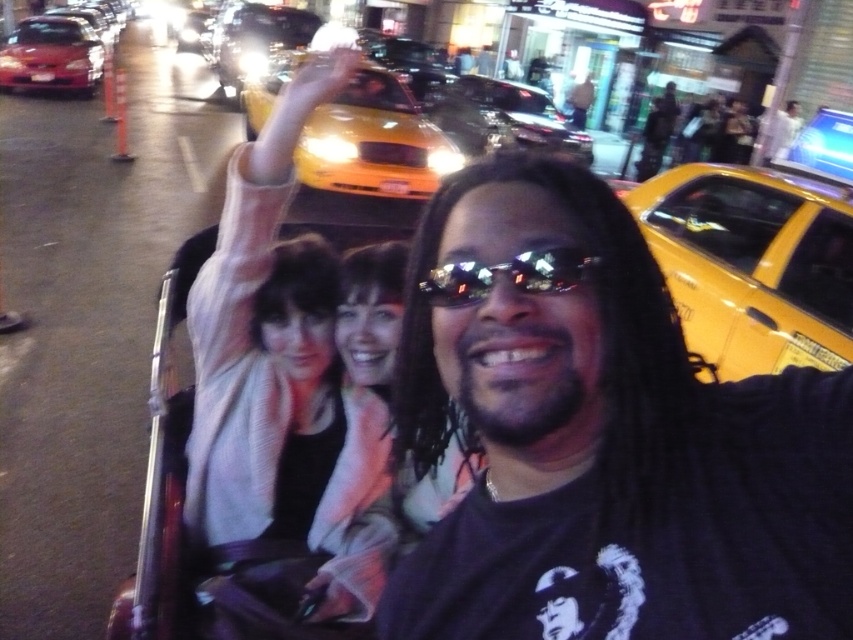
Question: Can you confirm if yellow matte taxi at right is positioned to the right of shiny reflective sunglasses at center?

Choices:
 (A) no
 (B) yes

Answer: (B)

Question: Is yellow matte taxi at right positioned before shiny red sedan at upper left?

Choices:
 (A) yes
 (B) no

Answer: (A)

Question: Considering the real-world distances, which object is farthest from the shiny red sedan at upper left?

Choices:
 (A) yellow matte taxi at upper center
 (B) dark gray t-shirt at center
 (C) shiny reflective sunglasses at center

Answer: (C)

Question: From the image, what is the correct spatial relationship of yellow matte taxi at right in relation to yellow taxi cab at center?

Choices:
 (A) below
 (B) above

Answer: (A)

Question: Which of the following is the farthest from the observer?

Choices:
 (A) (492, 204)
 (B) (337, 145)

Answer: (B)

Question: Which point is farther from the camera taking this photo?

Choices:
 (A) (460, 113)
 (B) (274, 307)

Answer: (A)